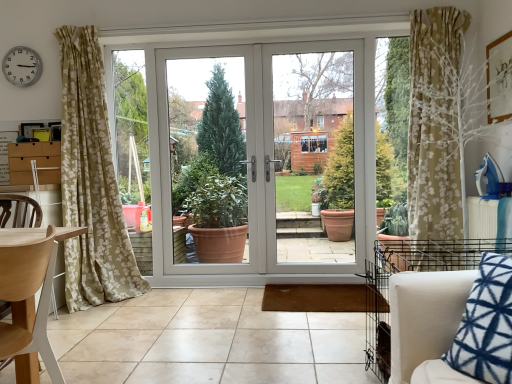
At what (x,y) coordinates should I click in order to perform the action: click on vacant space situated above white plastic door at center, the 2th window frame positioned from the right (from a real-world perspective). Please return your answer as a coordinate pair (x, y). This screenshot has height=384, width=512. Looking at the image, I should click on pos(203,46).